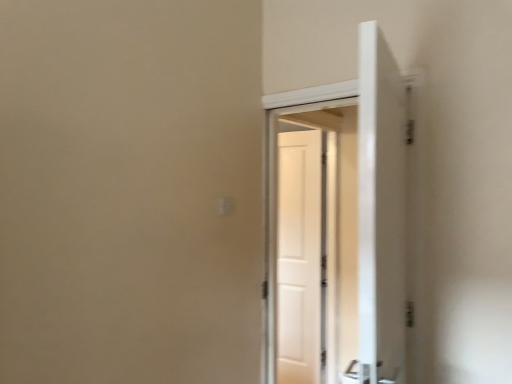
Question: Do you think white glossy door at center is within white matte door at center, or outside of it?

Choices:
 (A) inside
 (B) outside

Answer: (B)

Question: In terms of width, does white glossy door at center look wider or thinner when compared to white matte door at center?

Choices:
 (A) thin
 (B) wide

Answer: (B)

Question: From a real-world perspective, is white glossy door at center physically located above or below white matte door at center?

Choices:
 (A) below
 (B) above

Answer: (B)

Question: Is white matte door at center in front of or behind white glossy door at center in the image?

Choices:
 (A) front
 (B) behind

Answer: (B)

Question: Is white matte door at center inside the boundaries of white glossy door at center, or outside?

Choices:
 (A) outside
 (B) inside

Answer: (A)

Question: Is point (309, 352) closer or farther from the camera than point (269, 135)?

Choices:
 (A) closer
 (B) farther

Answer: (B)

Question: Looking at their shapes, would you say white matte door at center is wider or thinner than white glossy door at center?

Choices:
 (A) thin
 (B) wide

Answer: (A)